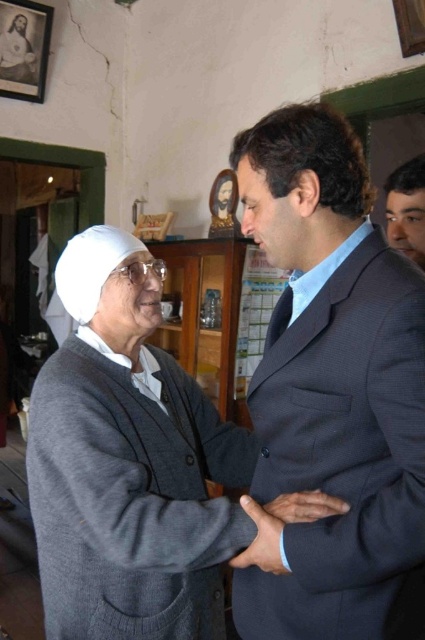
Question: Is dark blue textured suit at center further to camera compared to smooth skin hand at center?

Choices:
 (A) no
 (B) yes

Answer: (B)

Question: Which point is closer to the camera?

Choices:
 (A) dark blue textured suit at center
 (B) dark blue suit at center
 (C) blue woven tie at center
 (D) gray fabric hand at center

Answer: (B)

Question: Among these objects, which one is nearest to the camera?

Choices:
 (A) gray fabric hand at center
 (B) blue woven tie at center

Answer: (A)

Question: Observing the image, what is the correct spatial positioning of gray fabric hand at center in reference to smooth skin hand at center?

Choices:
 (A) above
 (B) below

Answer: (B)

Question: Which object is the closest to the dark blue suit at center?

Choices:
 (A) dark blue suit at right
 (B) gray fabric hand at center

Answer: (B)

Question: Is dark blue suit at center below smooth skin hand at center?

Choices:
 (A) no
 (B) yes

Answer: (A)